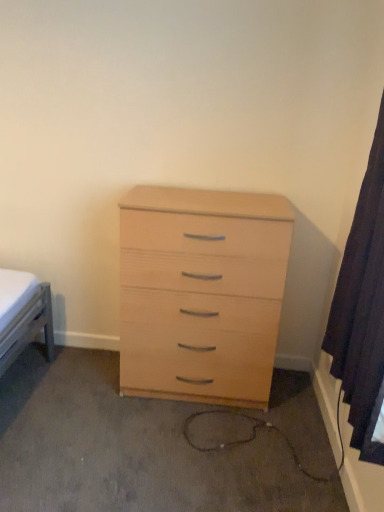
This screenshot has width=384, height=512. In order to click on free space to the left of light wood chest of drawers at center in this screenshot , I will do `click(76, 390)`.